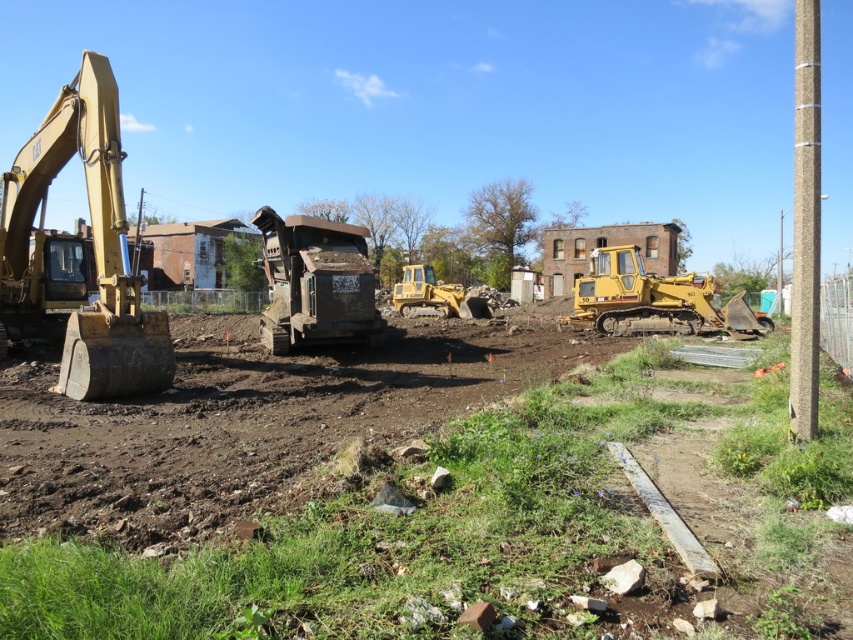
Question: Estimate the real-world distances between objects in this image. Which object is farther from the brown soil at center?

Choices:
 (A) brown textured pole at right
 (B) yellow rubber tracked excavator at center
 (C) yellow metallic excavator at left
 (D) dirty metal dump truck at center

Answer: (B)

Question: Which is nearer to the yellow rubber tracked excavator at center?

Choices:
 (A) brown soil at center
 (B) yellow metallic excavator at left
 (C) dirty metal dump truck at center

Answer: (A)

Question: Which of the following is the closest to the observer?

Choices:
 (A) dirty metal dump truck at center
 (B) brown soil at center
 (C) brown textured pole at right
 (D) yellow metallic excavator at left

Answer: (B)

Question: Can you confirm if yellow metallic excavator at left is wider than dirty metal dump truck at center?

Choices:
 (A) yes
 (B) no

Answer: (A)

Question: Is the position of dirty metal dump truck at center more distant than that of brown textured pole at right?

Choices:
 (A) no
 (B) yes

Answer: (B)

Question: Is the position of yellow metallic excavator at left less distant than that of yellow rubber tracked excavator at center?

Choices:
 (A) no
 (B) yes

Answer: (B)